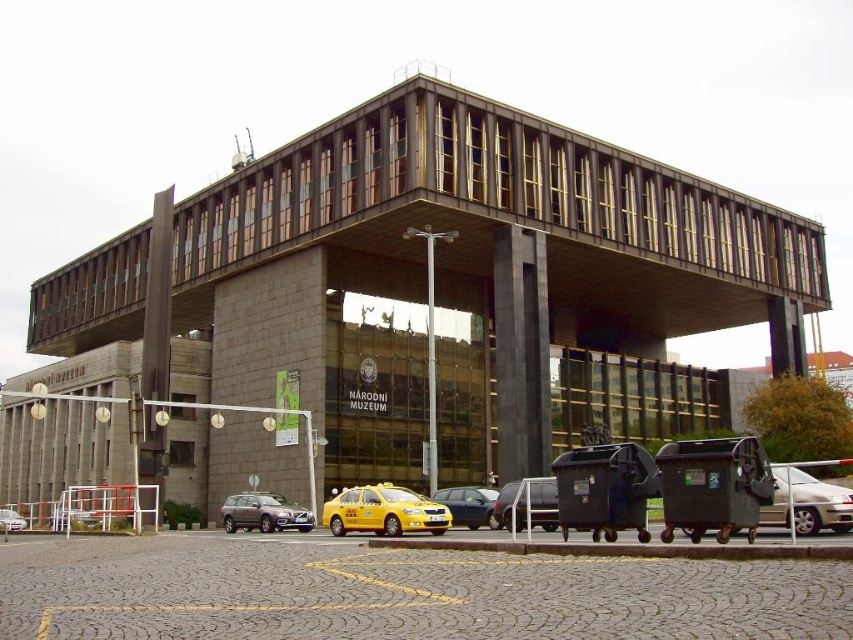
Does silver metallic sedan at lower right have a larger size compared to matte gray suv at center?

Incorrect, silver metallic sedan at lower right is not larger than matte gray suv at center.

Is point (802, 499) positioned in front of point (225, 500)?

Yes, point (802, 499) is closer to viewer.

At what (x,y) coordinates should I click in order to perform the action: click on silver metallic sedan at lower right. Please return your answer as a coordinate pair (x, y). This screenshot has height=640, width=853. Looking at the image, I should click on (807, 502).

Does silver metallic sedan at lower right have a greater width compared to silver metallic sedan at lower left?

Yes.

Does point (840, 506) come closer to viewer compared to point (24, 520)?

Yes, it is.

Is point (767, 524) positioned before point (10, 522)?

Yes.

Image resolution: width=853 pixels, height=640 pixels. Identify the location of silver metallic sedan at lower right. (807, 502).

Who is higher up, yellow matte taxi at lower center or metallic silver car at lower center?

metallic silver car at lower center is higher up.

Identify the location of yellow matte taxi at lower center. The image size is (853, 640). (383, 512).

Describe the element at coordinates (383, 512) in the screenshot. I see `yellow matte taxi at lower center` at that location.

Find the location of a particular element. The height and width of the screenshot is (640, 853). yellow matte taxi at lower center is located at coordinates (383, 512).